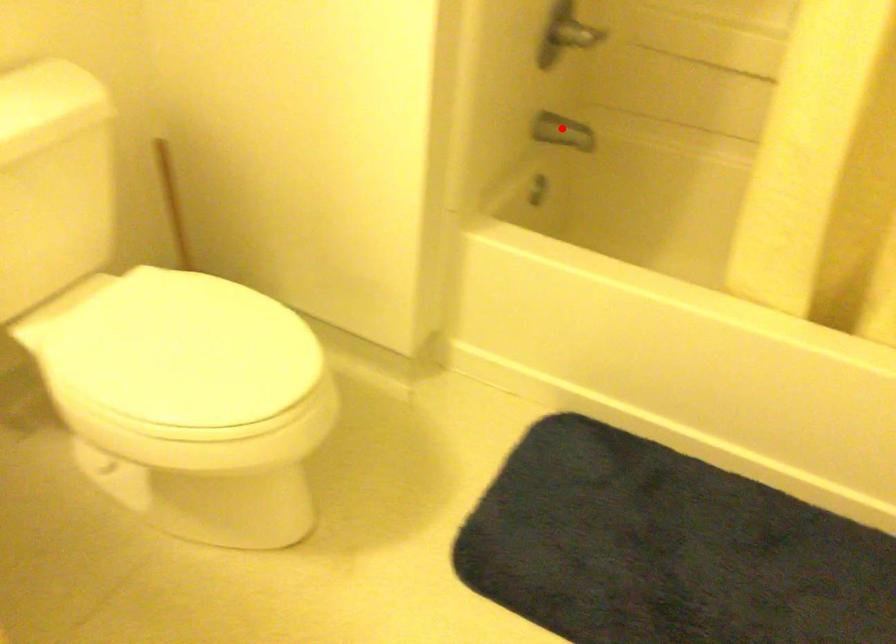
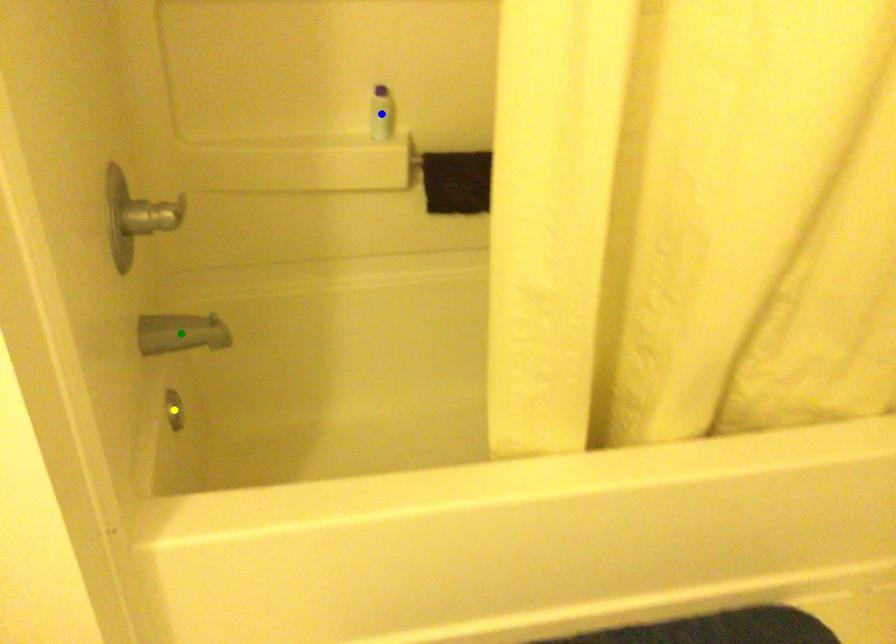
Question: I am providing you with two images of the same scene from different viewpoints. A red point is marked on the first image. You are given multiple points on the second image. Which point in image 2 represents the same 3d spot as the red point in image 1?

Choices:
 (A) green point
 (B) yellow point
 (C) blue point

Answer: (A)